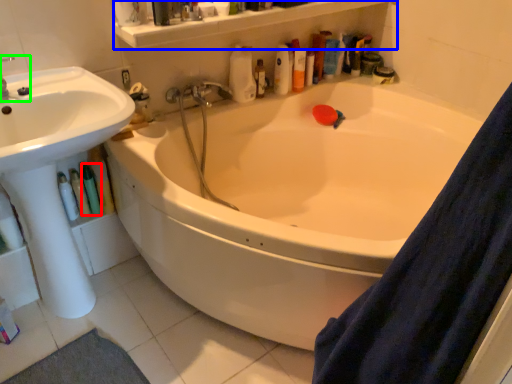
Question: Estimate the real-world distances between objects in this image. Which object is farther from toiletry (highlighted by a red box), balustrade (highlighted by a blue box) or plumbing fixture (highlighted by a green box)?

Choices:
 (A) balustrade
 (B) plumbing fixture

Answer: (A)